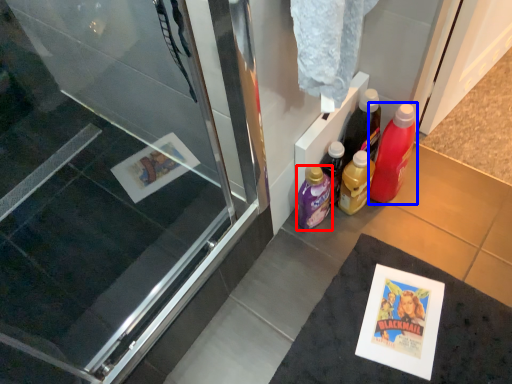
Question: Among these objects, which one is nearest to the camera, bottle (highlighted by a red box) or bottle (highlighted by a blue box)?

Choices:
 (A) bottle
 (B) bottle

Answer: (B)